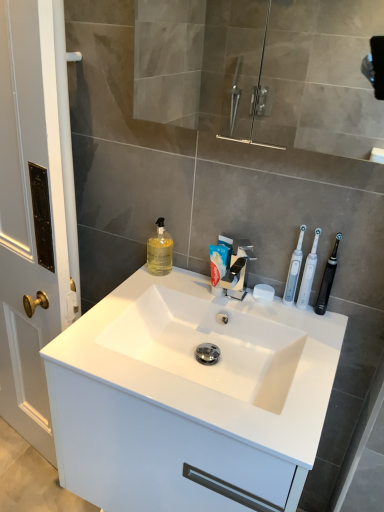
Question: Does transparent glass mirror at upper center have a greater height compared to translucent yellow liquid at sink left?

Choices:
 (A) yes
 (B) no

Answer: (A)

Question: Would you say transparent glass mirror at upper center is outside translucent yellow liquid at sink left?

Choices:
 (A) no
 (B) yes

Answer: (B)

Question: Is transparent glass mirror at upper center facing away from translucent yellow liquid at sink left?

Choices:
 (A) no
 (B) yes

Answer: (A)

Question: Does transparent glass mirror at upper center have a lesser height compared to translucent yellow liquid at sink left?

Choices:
 (A) yes
 (B) no

Answer: (B)

Question: Can you confirm if transparent glass mirror at upper center is wider than translucent yellow liquid at sink left?

Choices:
 (A) yes
 (B) no

Answer: (A)

Question: Is point (301, 460) positioned closer to the camera than point (327, 290)?

Choices:
 (A) closer
 (B) farther

Answer: (A)

Question: In terms of height, does white glossy cabinet at center look taller or shorter compared to black plastic toothbrush at right, which is the first toothbrush in right-to-left order?

Choices:
 (A) short
 (B) tall

Answer: (A)

Question: Choose the correct answer: Is white glossy cabinet at center inside black plastic toothbrush at right, which is the third toothbrush from left to right, or outside it?

Choices:
 (A) inside
 (B) outside

Answer: (B)

Question: Considering the relative positions of white glossy cabinet at center and black plastic toothbrush at right, which is the third toothbrush from left to right, in the image provided, is white glossy cabinet at center to the left or to the right of black plastic toothbrush at right, which is the third toothbrush from left to right,?

Choices:
 (A) right
 (B) left

Answer: (B)

Question: In terms of width, does transparent glass mirror at upper center look wider or thinner when compared to white matte toothpaste at center?

Choices:
 (A) wide
 (B) thin

Answer: (A)

Question: Is transparent glass mirror at upper center in front of or behind white matte toothpaste at center in the image?

Choices:
 (A) front
 (B) behind

Answer: (A)

Question: Is transparent glass mirror at upper center bigger or smaller than white matte toothpaste at center?

Choices:
 (A) big
 (B) small

Answer: (A)

Question: Is point (382, 129) closer or farther from the camera than point (213, 253)?

Choices:
 (A) farther
 (B) closer

Answer: (A)

Question: Do you think translucent yellow liquid at sink left is within white plastic toothbrushes at right, which is the 1th toothbrush in left-to-right order, or outside of it?

Choices:
 (A) outside
 (B) inside

Answer: (A)

Question: Considering their positions, is translucent yellow liquid at sink left located in front of or behind white plastic toothbrushes at right, which is the third toothbrush in right-to-left order?

Choices:
 (A) front
 (B) behind

Answer: (B)